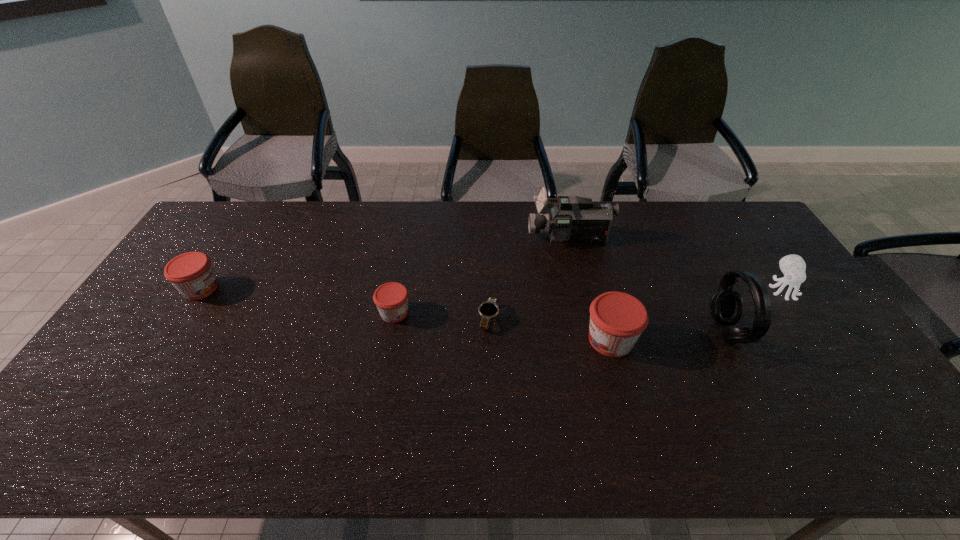
Where is `vacant region that satisfies the following two spatial constraints: 1. on the front label of the shortest object; 2. on the right side of the leftmost object`? vacant region that satisfies the following two spatial constraints: 1. on the front label of the shortest object; 2. on the right side of the leftmost object is located at coordinates (181, 319).

You are a GUI agent. You are given a task and a screenshot of the screen. Output one action in this format:
    pyautogui.click(x=<x>, y=<y>)
    Task: Click on the free space that satisfies the following two spatial constraints: 1. on the front-facing side of the octopus; 2. on the front label of the second shortest object
    This screenshot has height=540, width=960.
    Given the screenshot: What is the action you would take?
    pyautogui.click(x=799, y=313)

Identify the location of blank area in the image that satisfies the following two spatial constraints: 1. on the front-facing side of the octopus; 2. on the front label of the second jam from right to left. The height and width of the screenshot is (540, 960). point(799,313).